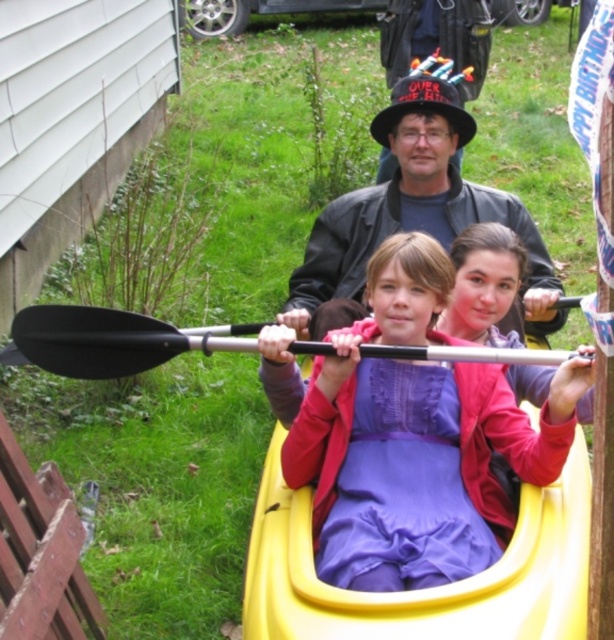
Question: Can you confirm if yellow plastic canoe at center is positioned above matte black jacket at center?

Choices:
 (A) no
 (B) yes

Answer: (A)

Question: Which point is closer to the camera?

Choices:
 (A) (591, 364)
 (B) (265, 628)
 (C) (79, 326)

Answer: (B)

Question: Which point is farther from the camera taking this photo?

Choices:
 (A) (418, 356)
 (B) (359, 234)
 (C) (432, 268)
 (D) (480, 577)

Answer: (B)

Question: Is yellow plastic canoe at center below black rubber paddle at center?

Choices:
 (A) yes
 (B) no

Answer: (A)

Question: Is purple fabric dress at center positioned before matte black jacket at center?

Choices:
 (A) no
 (B) yes

Answer: (B)

Question: Among these points, which one is farthest from the camera?

Choices:
 (A) pos(543,256)
 (B) pos(502,426)
 (C) pos(99,364)
 (D) pos(497,609)

Answer: (A)